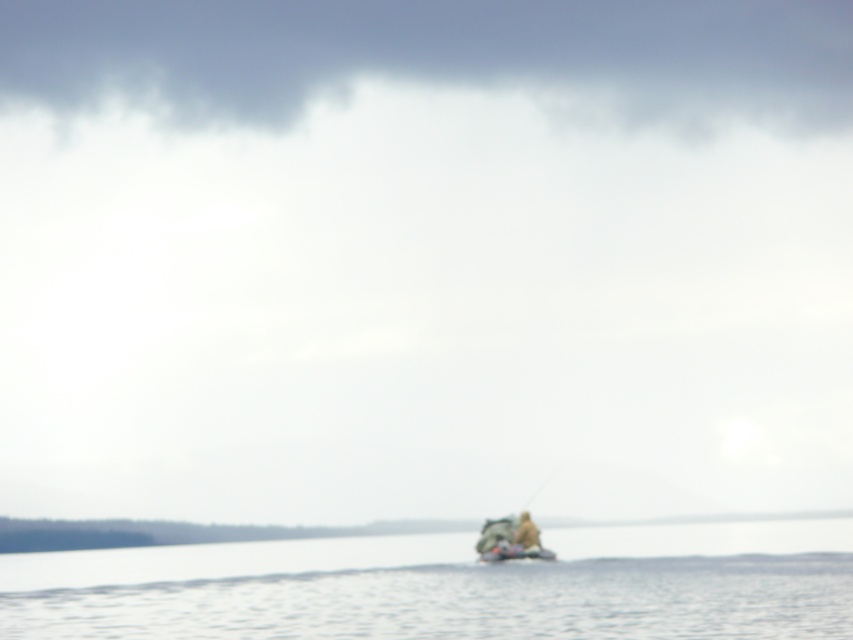
Who is positioned more to the left, camouflage fabric boat at lower center or camouflage fabric canoe at center?

camouflage fabric canoe at center is more to the left.

Does camouflage fabric boat at lower center have a greater width compared to camouflage fabric canoe at center?

Yes, camouflage fabric boat at lower center is wider than camouflage fabric canoe at center.

The width and height of the screenshot is (853, 640). Identify the location of camouflage fabric boat at lower center. (509, 540).

Locate an element on the screen. This screenshot has width=853, height=640. camouflage fabric boat at lower center is located at coordinates (509, 540).

Does point (505, 528) lie in front of point (537, 536)?

No, it is behind (537, 536).

From the picture: Is camouflage fabric boat at lower center above brown fabric person at center?

Actually, camouflage fabric boat at lower center is below brown fabric person at center.

Identify the location of camouflage fabric boat at lower center. (509, 540).

Looking at this image, can you confirm if clear water at center is positioned to the left of camouflage fabric canoe at center?

Correct, you'll find clear water at center to the left of camouflage fabric canoe at center.

Is clear water at center below camouflage fabric canoe at center?

Yes, clear water at center is below camouflage fabric canoe at center.

Identify the location of clear water at center. (450, 586).

This screenshot has height=640, width=853. In order to click on clear water at center in this screenshot , I will do `click(450, 586)`.